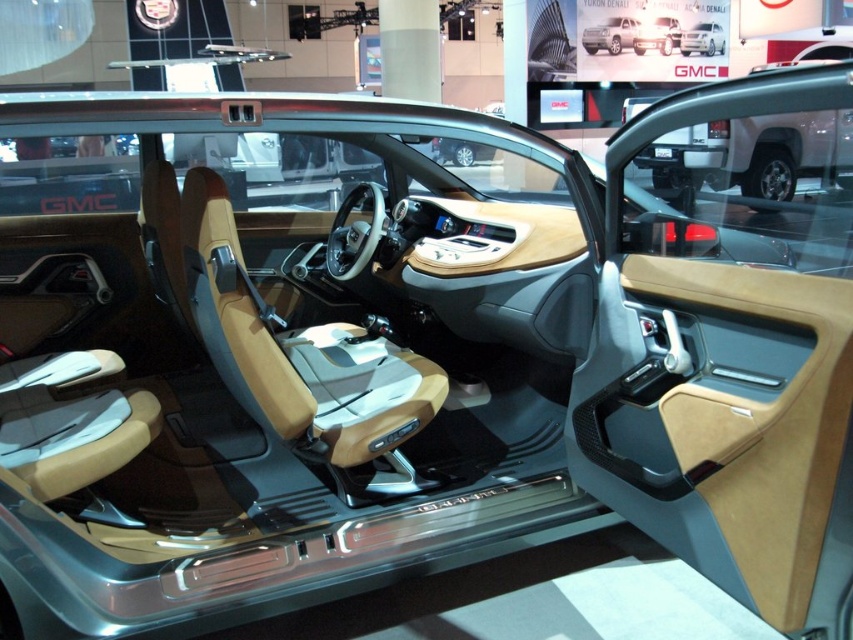
Question: Does white matte truck at upper center have a larger size compared to white glossy truck at upper center?

Choices:
 (A) no
 (B) yes

Answer: (A)

Question: Which point appears closest to the camera in this image?

Choices:
 (A) (688, 28)
 (B) (691, 129)

Answer: (B)

Question: Does white matte truck at upper center have a larger size compared to white glossy truck at upper center?

Choices:
 (A) no
 (B) yes

Answer: (A)

Question: Does white matte truck at upper center have a greater width compared to white glossy truck at upper center?

Choices:
 (A) yes
 (B) no

Answer: (B)

Question: Among these points, which one is nearest to the camera?

Choices:
 (A) (711, 51)
 (B) (682, 131)

Answer: (B)